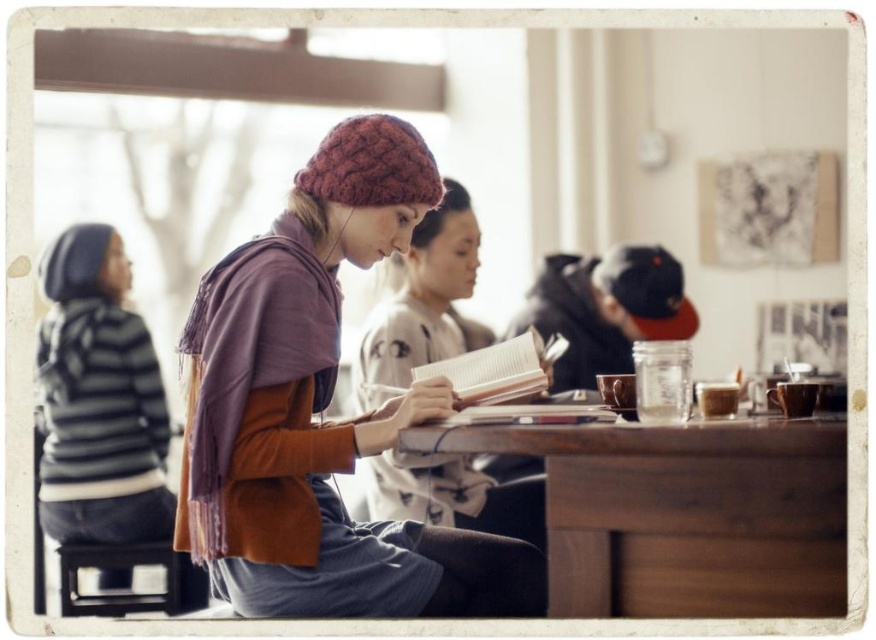
Question: Can you confirm if wooden table at center is positioned above white paper book at center?

Choices:
 (A) yes
 (B) no

Answer: (B)

Question: Which object appears closest to the camera in this image?

Choices:
 (A) knitted wool beanie at center
 (B) cable-knit wool beanie at center
 (C) white paper book at center
 (D) wooden table at center

Answer: (D)

Question: Is cable-knit wool beanie at center to the left of dark brown wooden stool at lower left from the viewer's perspective?

Choices:
 (A) yes
 (B) no

Answer: (B)

Question: Which object is positioned farthest from the white paper book at center?

Choices:
 (A) dark brown wooden stool at lower left
 (B) knitted wool beanie at center
 (C) wooden table at center

Answer: (A)

Question: Which point appears farthest from the camera in this image?

Choices:
 (A) (533, 336)
 (B) (599, 580)
 (C) (87, 552)
 (D) (337, 426)

Answer: (C)

Question: Can you confirm if cable-knit wool beanie at center is positioned above knitted wool beanie at center?

Choices:
 (A) no
 (B) yes

Answer: (B)